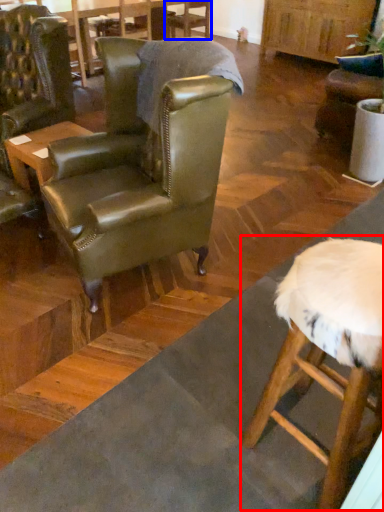
Question: Which object is closer to the camera taking this photo, bar stool (highlighted by a red box) or chair (highlighted by a blue box)?

Choices:
 (A) bar stool
 (B) chair

Answer: (A)